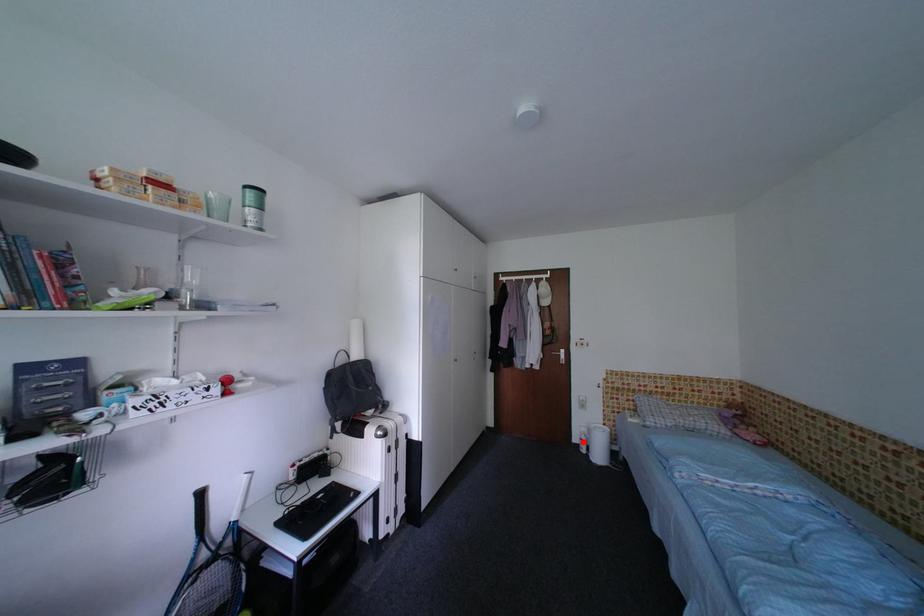
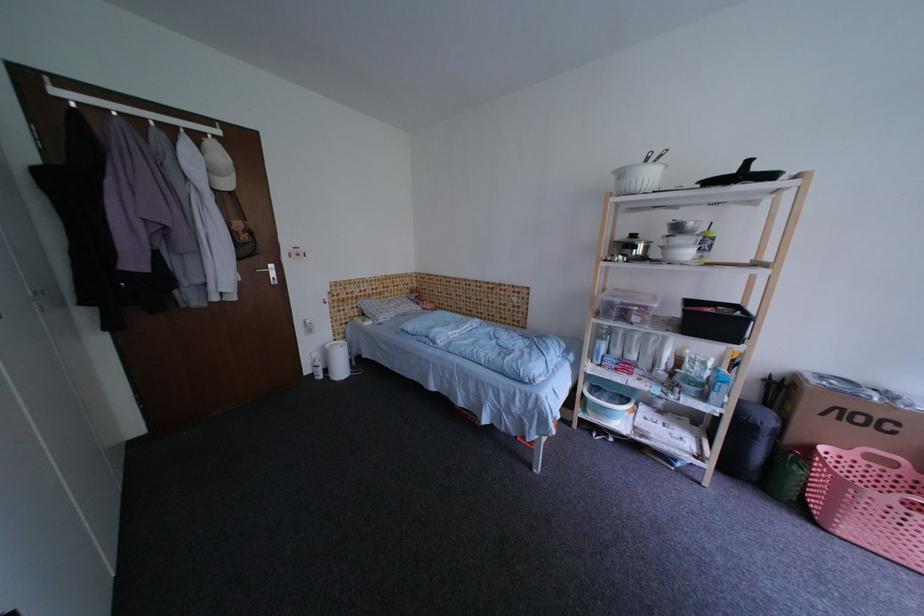
Question: I am providing you with two images of the same scene from different viewpoints. In image1, a red point is highlighted. Considering the same 3D point in image2, which of the following is correct?

Choices:
 (A) It is closer
 (B) It is farther

Answer: (A)